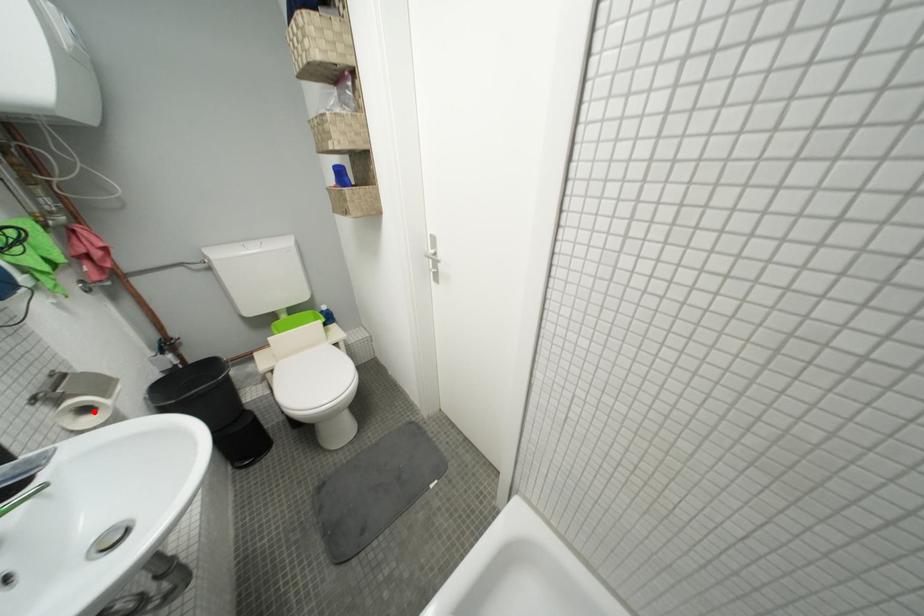
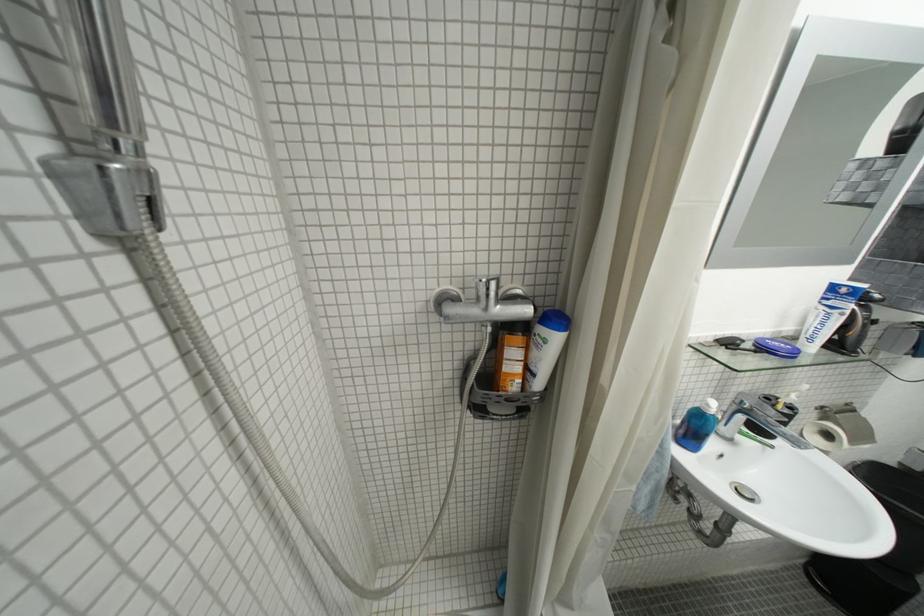
Question: I am providing you with two images of the same scene from different viewpoints. A red point is shown in image1. For the corresponding object point in image2, is it positioned nearer or farther from the camera?

Choices:
 (A) Nearer
 (B) Farther

Answer: (A)